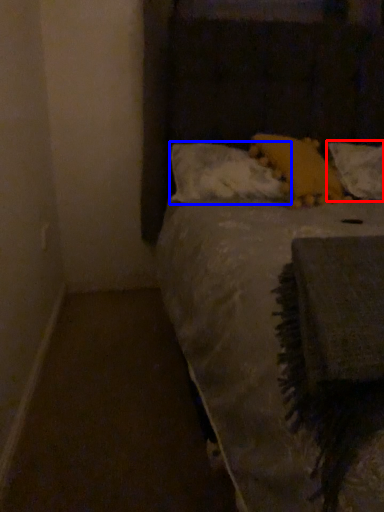
Question: Which point is closer to the camera, pillow (highlighted by a red box) or pillow (highlighted by a blue box)?

Choices:
 (A) pillow
 (B) pillow

Answer: (B)